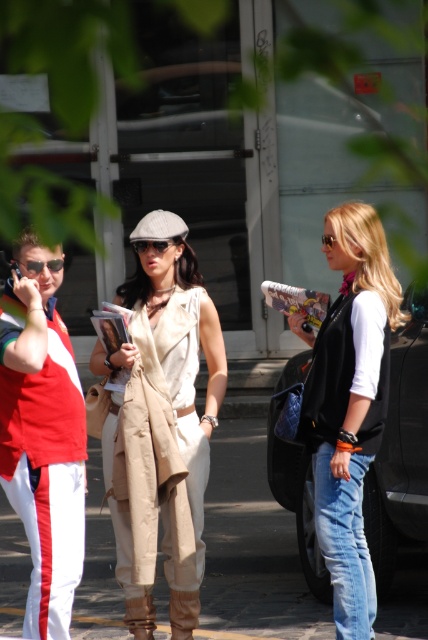
You are a delivery person needing to place a package between the black glossy car at center and the matte black sunglasses at center. Can you fit the package there if it requires at least 5 feet of space?

The black glossy car at center and the matte black sunglasses at center are 6.02 feet apart, so yes, the package can be placed there since the required space is met.

You are a fashion designer observing the beige fabric dress at center and the matte black sunglasses at center in the scene. Which item is taller?

The beige fabric dress at center is taller than the matte black sunglasses at center.